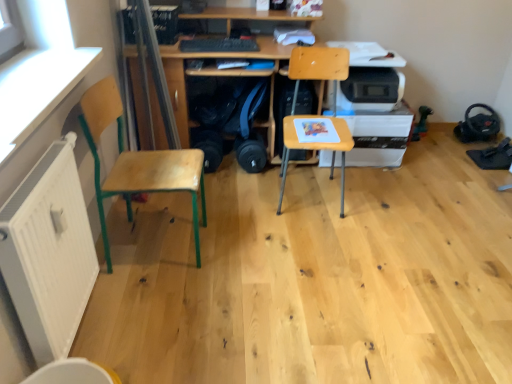
At what (x,y) coordinates should I click in order to perform the action: click on space that is in front of white plastic printer at center right. Please return your answer as a coordinate pair (x, y). The height and width of the screenshot is (384, 512). Looking at the image, I should click on (380, 187).